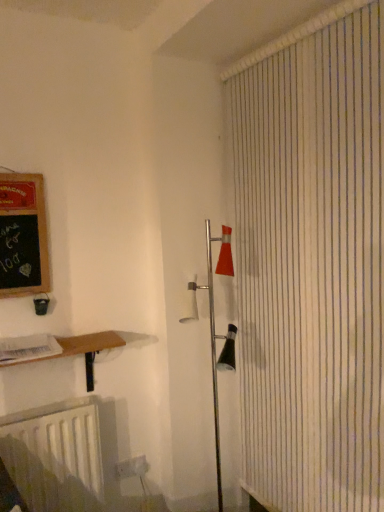
Question: From the image's perspective, is white striped shower curtain at right above or below white matte radiator at lower left?

Choices:
 (A) below
 (B) above

Answer: (B)

Question: Is white striped shower curtain at right inside the boundaries of white matte radiator at lower left, or outside?

Choices:
 (A) inside
 (B) outside

Answer: (B)

Question: Which is farther from the white plastic electric outlet at lower center?

Choices:
 (A) black chalkboard at left
 (B) wooden at lower left
 (C) white matte radiator at lower left
 (D) white striped shower curtain at right

Answer: (D)

Question: Which object is the closest to the wooden at lower left?

Choices:
 (A) black chalkboard at left
 (B) white plastic electric outlet at lower center
 (C) white matte radiator at lower left
 (D) white striped shower curtain at right

Answer: (C)